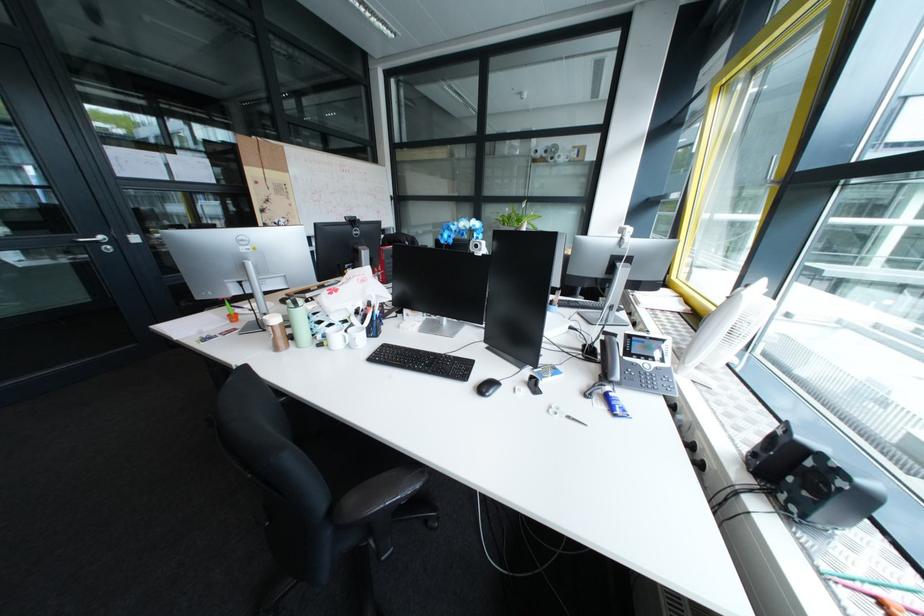
Which object does [488,387] point to?

This point indicates the black computer mouse.